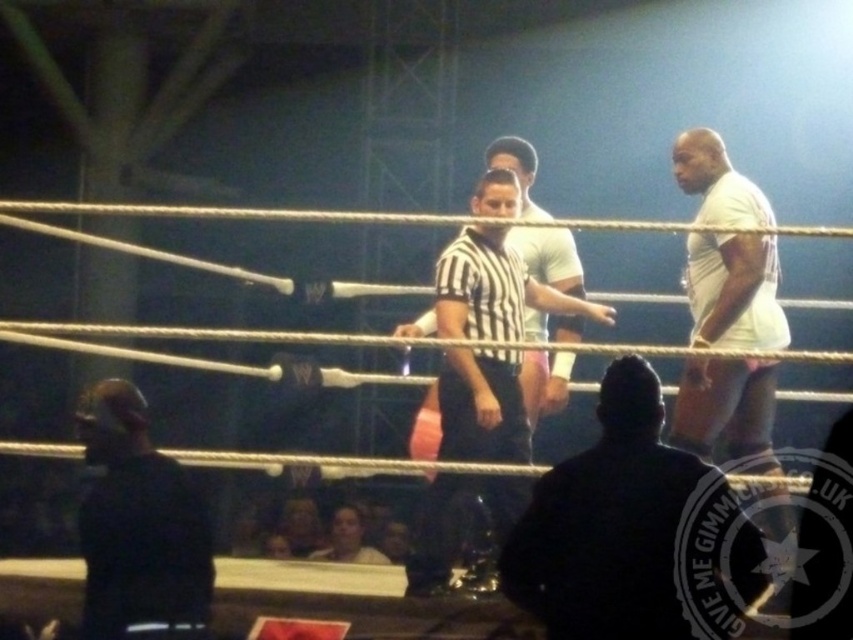
Is dark gray suit at center further to camera compared to black matte jacket at lower left?

No, it is not.

What do you see at coordinates (605, 524) in the screenshot? I see `dark gray suit at center` at bounding box center [605, 524].

Find the location of a particular element. This screenshot has height=640, width=853. dark gray suit at center is located at coordinates (605, 524).

In the scene shown: Which is below, dark gray suit at center or black striped shirt at center?

dark gray suit at center is lower down.

Can you confirm if dark gray suit at center is bigger than black striped shirt at center?

Actually, dark gray suit at center might be smaller than black striped shirt at center.

Between point (520, 568) and point (502, 252), which one is positioned behind?

Positioned behind is point (502, 252).

The width and height of the screenshot is (853, 640). Find the location of `dark gray suit at center`. dark gray suit at center is located at coordinates (605, 524).

Can you confirm if black striped shirt at center is wider than white matte shirt at right?

Indeed, black striped shirt at center has a greater width compared to white matte shirt at right.

Does black striped shirt at center appear on the left side of white matte shirt at right?

Indeed, black striped shirt at center is positioned on the left side of white matte shirt at right.

The width and height of the screenshot is (853, 640). Identify the location of black striped shirt at center. (492, 289).

The image size is (853, 640). Find the location of `black striped shirt at center`. black striped shirt at center is located at coordinates (492, 289).